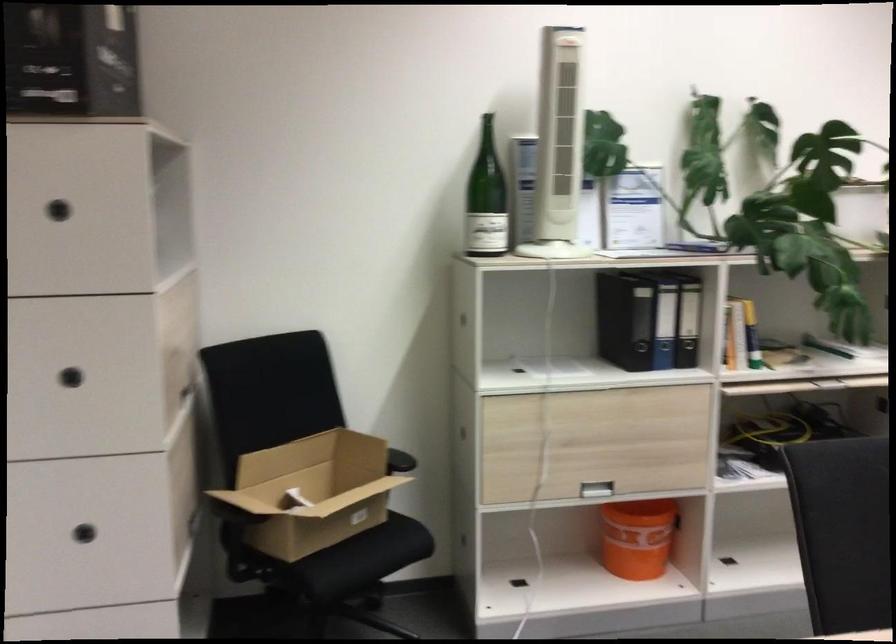
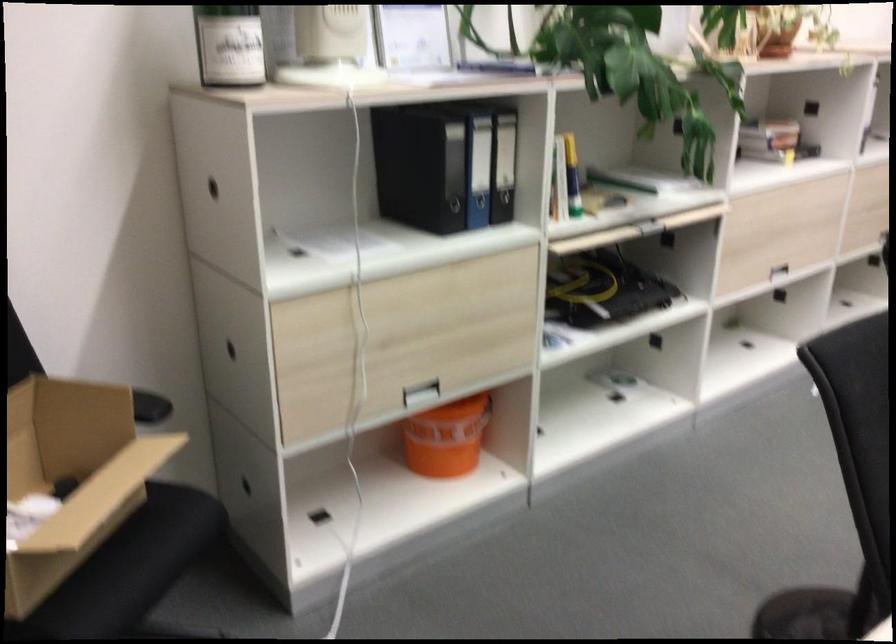
Where in the second image is the point corresponding to point 483,228 from the first image?

(229, 44)